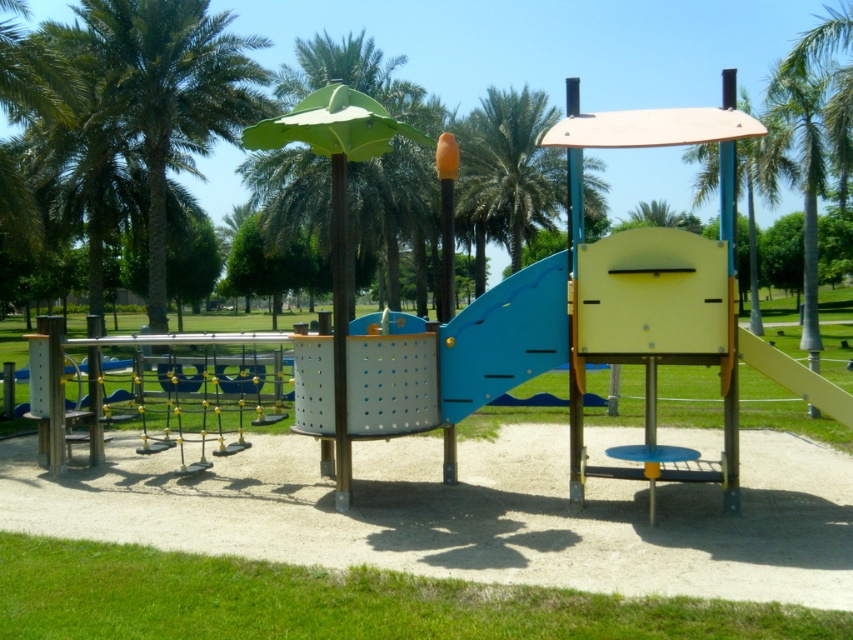
Question: Is green leafy palm tree at upper left above green leafy palm tree at upper center?

Choices:
 (A) yes
 (B) no

Answer: (B)

Question: Which point is closer to the camera?

Choices:
 (A) green leafy palm tree at upper center
 (B) green leafy palm tree at center

Answer: (A)

Question: Where is green leafy palm tree at upper right located in relation to green leafy palm tree at upper center in the image?

Choices:
 (A) below
 (B) above

Answer: (A)

Question: Which object appears farthest from the camera in this image?

Choices:
 (A) green leafy umbrella at center
 (B) green leafy palm tree at upper right

Answer: (B)

Question: Which of these objects is positioned closest to the green leafy palm tree at center?

Choices:
 (A) green leafy umbrella at center
 (B) green leafy palm tree at upper center
 (C) green leafy palm tree at upper left

Answer: (B)

Question: Does green leafy palm tree at upper left appear over green leafy palm tree at center?

Choices:
 (A) yes
 (B) no

Answer: (B)